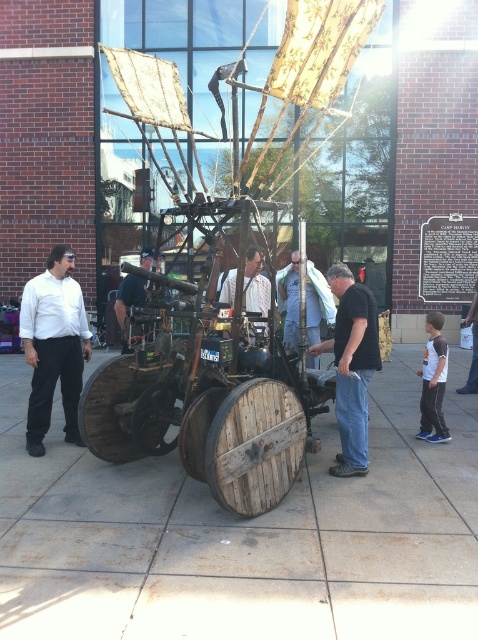
Can you confirm if black cotton shirt at center is shorter than wooden barrel at center?

No, black cotton shirt at center is not shorter than wooden barrel at center.

In the scene shown: Who is more forward, (x=377, y=362) or (x=247, y=259)?

Point (x=377, y=362) is in front.

Locate an element on the screen. black cotton shirt at center is located at coordinates (351, 365).

I want to click on black cotton shirt at center, so click(351, 365).

Describe the element at coordinates (351, 365) in the screenshot. The width and height of the screenshot is (478, 640). I see `black cotton shirt at center` at that location.

Find the location of a particular element. black cotton shirt at center is located at coordinates (351, 365).

Is point (304, 419) farther from viewer compared to point (28, 356)?

No, it is in front of (28, 356).

Which is below, wooden cart at center or matte white shirt at left?

matte white shirt at left is lower down.

Describe the element at coordinates (225, 266) in the screenshot. The image size is (478, 640). I see `wooden cart at center` at that location.

At what (x,y) coordinates should I click in order to perform the action: click on wooden cart at center. Please return your answer as a coordinate pair (x, y). Looking at the image, I should click on (225, 266).